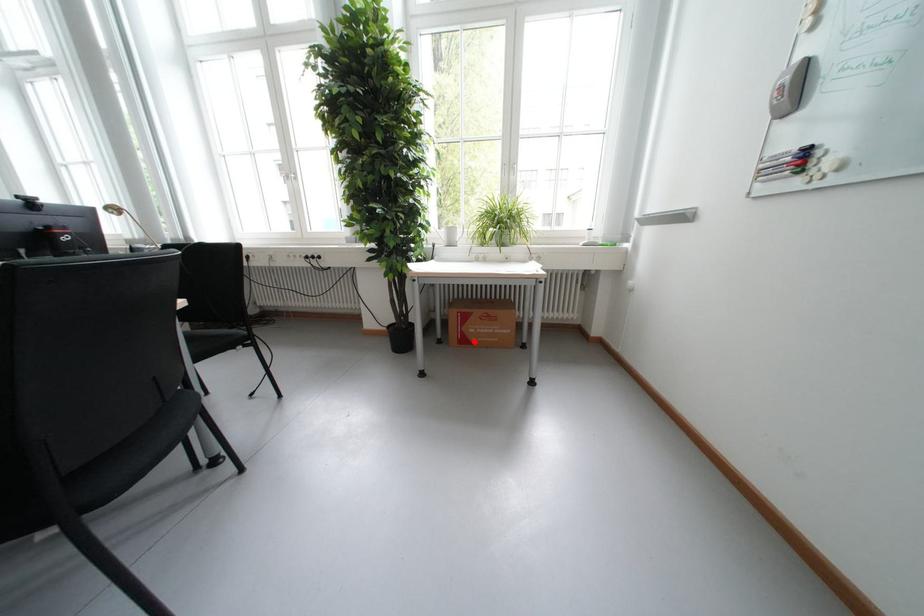
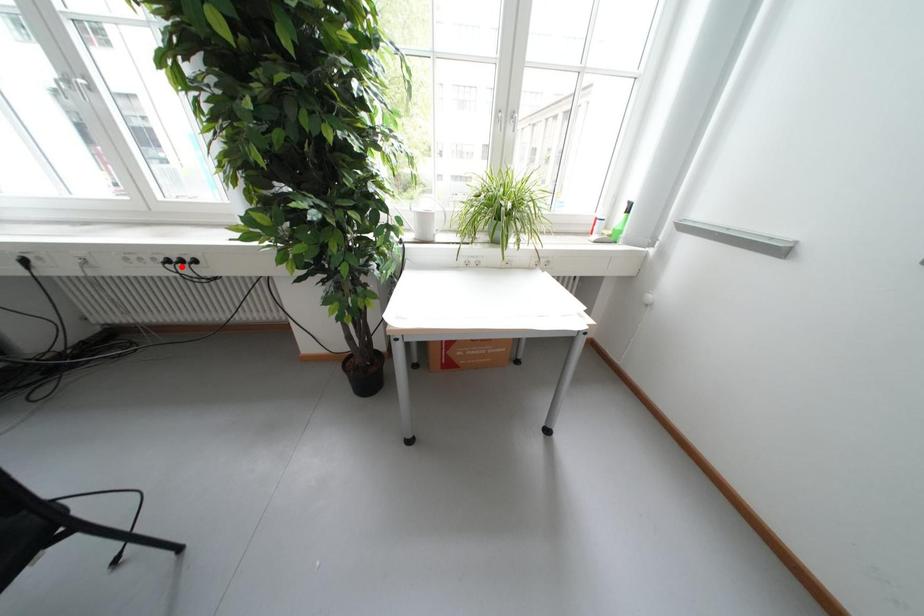
I am providing you with two images of the same scene from different viewpoints. A red point is marked on the first image and another point is marked on the second image. Is the red point in image1 aligned with the point shown in image2?

No